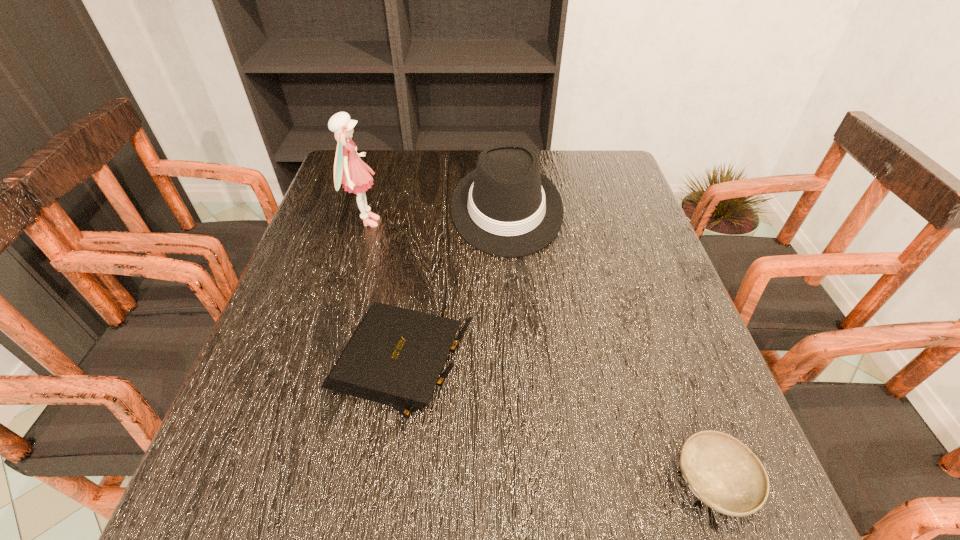
In order to click on object that is at the far edge in this screenshot , I will do `click(506, 207)`.

Find the location of `object located in the near edge section of the desktop`. object located in the near edge section of the desktop is located at coordinates (722, 472).

Identify the location of doll located in the left edge section of the desktop. (349, 170).

Locate an element on the screen. This screenshot has height=540, width=960. router that is at the left edge is located at coordinates (395, 356).

This screenshot has height=540, width=960. What are the coordinates of `object located in the right edge section of the desktop` in the screenshot? It's located at (722, 472).

You are a GUI agent. You are given a task and a screenshot of the screen. Output one action in this format:
    pyautogui.click(x=<x>, y=<y>)
    Task: Click on the object present at the near right corner
    
    Given the screenshot: What is the action you would take?
    pyautogui.click(x=722, y=472)

Identify the location of vacant region at the far edge. This screenshot has width=960, height=540. (404, 187).

In the image, there is a desktop. Where is `free space at the near edge`? The image size is (960, 540). free space at the near edge is located at coordinates (399, 530).

Find the location of a particular element. The width and height of the screenshot is (960, 540). blank space at the left edge is located at coordinates (x=330, y=337).

This screenshot has width=960, height=540. I want to click on vacant space at the right edge of the desktop, so click(627, 206).